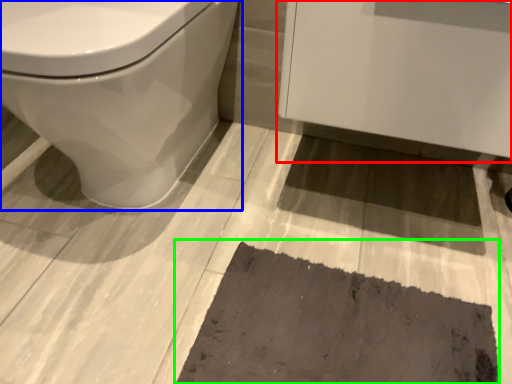
Question: Which is farther away from porcelain (highlighted by a red box)? toilet (highlighted by a blue box) or bath mat (highlighted by a green box)?

Choices:
 (A) toilet
 (B) bath mat

Answer: (B)